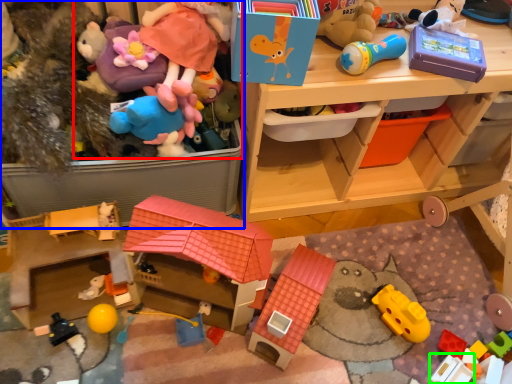
Question: Which object is positioned closest to toy (highlighted by a red box)? Select from toy (highlighted by a blue box) and toy (highlighted by a green box).

Choices:
 (A) toy
 (B) toy

Answer: (A)